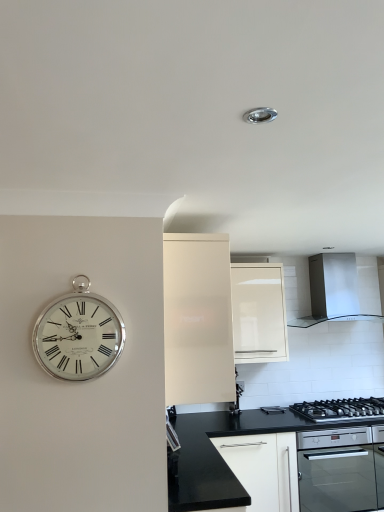
Question: Considering the positions of matte white cabinet at center, the first cabinetry positioned from the left, and white glossy cabinet at upper center, placed as the 1th cabinetry when sorted from right to left, in the image, is matte white cabinet at center, the first cabinetry positioned from the left, taller or shorter than white glossy cabinet at upper center, placed as the 1th cabinetry when sorted from right to left,?

Choices:
 (A) tall
 (B) short

Answer: (A)

Question: Would you say matte white cabinet at center, the second cabinetry positioned from the right, is inside or outside white glossy cabinet at upper center, the second cabinetry positioned from the left?

Choices:
 (A) inside
 (B) outside

Answer: (B)

Question: Estimate the real-world distances between objects in this image. Which object is closer to the matte white cabinet at center, the second cabinetry positioned from the right?

Choices:
 (A) black granite countertop at lower center
 (B) silver metallic clock at left
 (C) stainless steel range hood at upper right
 (D) white glossy cabinet at upper center, the second cabinetry positioned from the left
 (E) black stainless steel gas stove at lower right

Answer: (B)

Question: Based on their relative distances, which object is farther from the matte white cabinet at center, the first cabinetry positioned from the left?

Choices:
 (A) stainless steel range hood at upper right
 (B) black glass oven at lower right
 (C) silver metallic clock at left
 (D) black stainless steel gas stove at lower right
 (E) white glossy cabinet at upper center, the second cabinetry positioned from the left

Answer: (A)